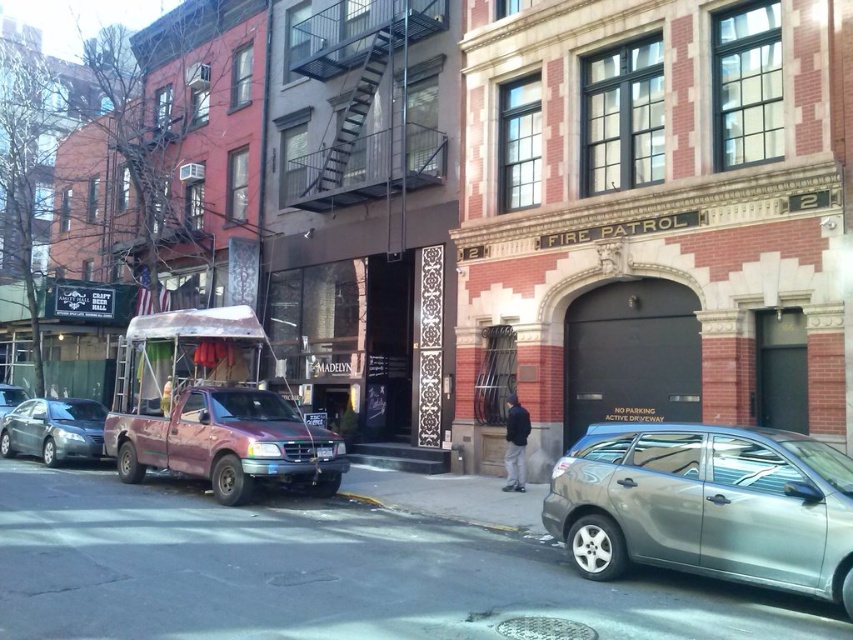
You are a delivery driver who needs to park your vehicle in this area. There is a silver metallic car at center. According to the scene description, where exactly is the silver metallic car positioned relative to the buildings and other landmarks?

→ The silver metallic car at center is located at point coordinates approximately 0.791 on the x axis and 0.829 on the y axis, which places it centrally within the scene between the buildings and any other landmarks mentioned.

You are standing at the center of the street in the image. Which direction should you walk to reach the rusty metal food truck at left?

You should walk to the left to reach the rusty metal food truck at left since it is located at the left side of the image.

You are a delivery person trying to park your truck in the area shown. The rusty metal food truck at left is currently blocking the entrance to the building with the FIRE PATROL sign. Can you maneuver around it using the space next to the yellow rubber at lower center?

The rusty metal food truck at left is larger than the yellow rubber at lower center, so it might be difficult to maneuver around it using the space next to the yellow rubber at lower center. The yellow rubber at lower center may not provide enough space for the delivery truck to pass safely.